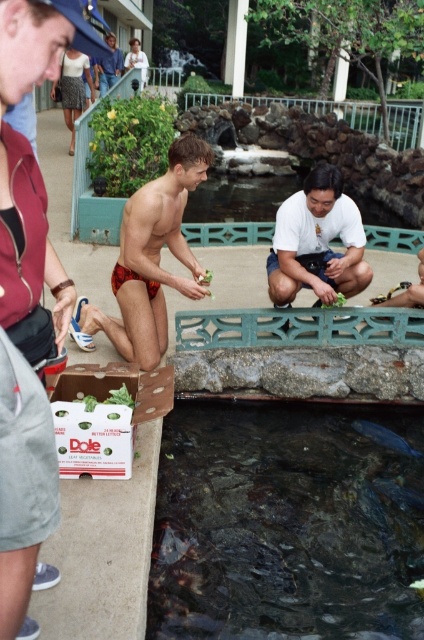
Between reddish-brown fabric shorts at center and shiny dark blue fish at lower center, which one appears on the right side from the viewer's perspective?

shiny dark blue fish at lower center is more to the right.

Between reddish-brown fabric shorts at center and shiny dark blue fish at lower center, which one is positioned lower?

Positioned lower is shiny dark blue fish at lower center.

Image resolution: width=424 pixels, height=640 pixels. What do you see at coordinates (150, 260) in the screenshot?
I see `reddish-brown fabric shorts at center` at bounding box center [150, 260].

Identify the location of reddish-brown fabric shorts at center. (150, 260).

Is white cardboard box at lower center further to the viewer compared to shiny dark blue fish at lower center?

No, it is in front of shiny dark blue fish at lower center.

Looking at this image, is white cardboard box at lower center wider than shiny dark blue fish at lower center?

Yes, white cardboard box at lower center is wider than shiny dark blue fish at lower center.

In order to click on white cardboard box at lower center in this screenshot , I will do `click(105, 416)`.

Identify the location of white cardboard box at lower center. The width and height of the screenshot is (424, 640). (105, 416).

Between smooth skin man at center and shiny silver fish at lower center, which one is positioned higher?

smooth skin man at center is higher up.

Is smooth skin man at center in front of shiny silver fish at lower center?

Yes, smooth skin man at center is in front of shiny silver fish at lower center.

Is point (108, 60) behind point (415, 451)?

Yes, it is.

Where is `smooth skin man at center`? smooth skin man at center is located at coordinates (108, 65).